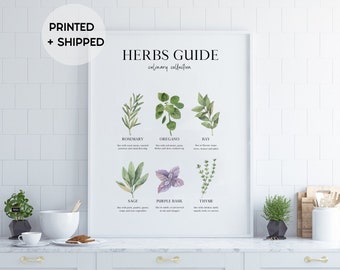
Where is `poster title`? The image size is (340, 270). poster title is located at coordinates point(172,55).